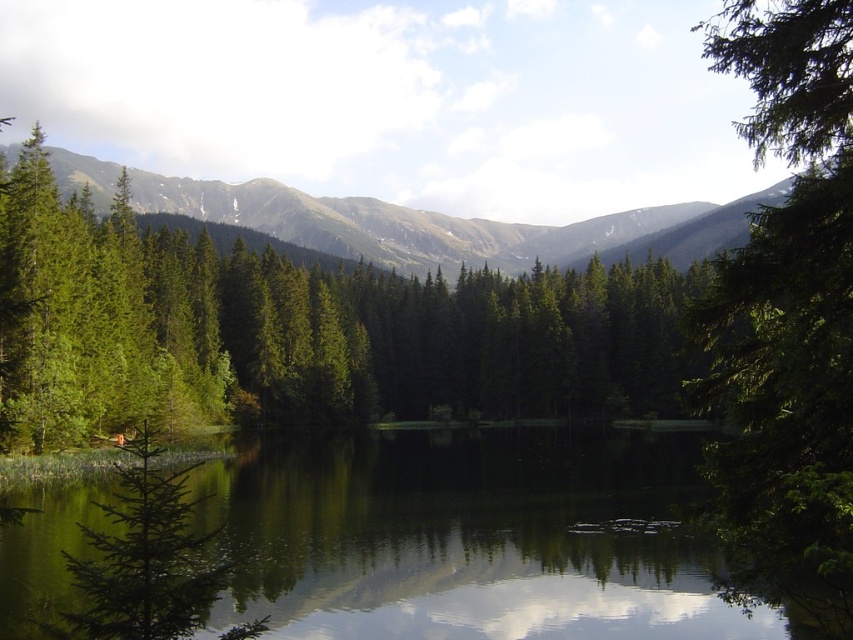
Question: Among these points, which one is farthest from the camera?

Choices:
 (A) (518, 579)
 (B) (389, 387)
 (C) (843, 378)

Answer: (B)

Question: Which of these objects is positioned farthest from the green reflective water at center?

Choices:
 (A) green textured forest at upper center
 (B) green matte tree at lower left

Answer: (A)

Question: Can you confirm if green matte tree at center is positioned to the right of green leafy tree at right?

Choices:
 (A) no
 (B) yes

Answer: (A)

Question: Which of the following is the farthest from the observer?

Choices:
 (A) (440, 257)
 (B) (177, 612)
 (C) (360, 260)
 (D) (779, 556)

Answer: (A)

Question: From the image, what is the correct spatial relationship of green textured forest at upper center in relation to green matte tree at lower left?

Choices:
 (A) above
 (B) below

Answer: (A)

Question: Is green leafy tree at right smaller than green textured forest at upper center?

Choices:
 (A) yes
 (B) no

Answer: (B)